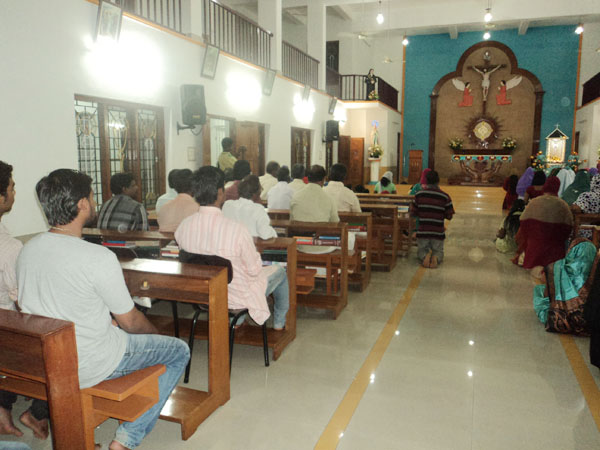
The image size is (600, 450). Find the location of `cruxifix`. cruxifix is located at coordinates [488, 63].